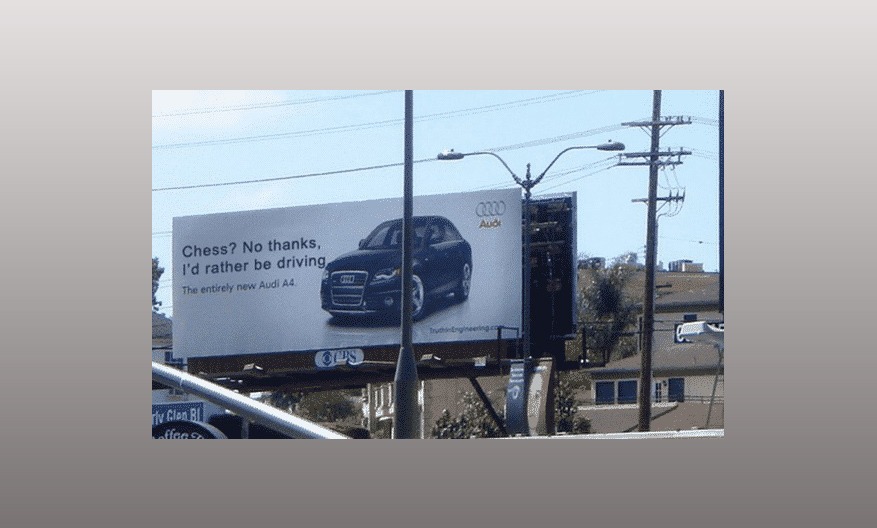
You are a GUI agent. You are given a task and a screenshot of the screen. Output one action in this format:
    pyautogui.click(x=<x>, y=<y>)
    Task: Click on the wires
    This screenshot has height=528, width=877.
    Given the screenshot: What is the action you would take?
    pyautogui.click(x=573, y=132)